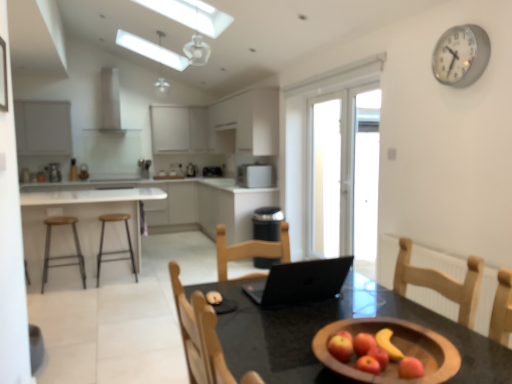
In order to face metallic brown stool at left, the 2th stool viewed from the right, should I rotate leftwards or rightwards?

To face it directly, rotate left by 24.686 degrees.

What is the approximate width of metallic brown stool at left, the 2th stool viewed from the right?

The width of metallic brown stool at left, the 2th stool viewed from the right, is 16.04 inches.

The image size is (512, 384). Describe the element at coordinates (184, 202) in the screenshot. I see `white matte cabinetry at left, which is the 4th cabinetry from right to left` at that location.

What do you see at coordinates (326, 177) in the screenshot? I see `transparent glass door at center` at bounding box center [326, 177].

What is the approximate width of white matte cabinet at center, arranged as the 1th cabinetry when viewed from the right?

white matte cabinet at center, arranged as the 1th cabinetry when viewed from the right, is 24.96 inches in width.

This screenshot has height=384, width=512. What are the coordinates of `matte white cabinet at left, the first cabinetry viewed from the left` in the screenshot? It's located at (42, 128).

At what (x,y) coordinates should I click in order to perform the action: click on satin silver toaster at center, which appears as the second appliance when viewed from the right. Please return your answer as a coordinate pair (x, y). The width and height of the screenshot is (512, 384). Looking at the image, I should click on (191, 170).

Could red matte apple at lower center be considered to be inside white metallic clock at upper right?

No, white metallic clock at upper right does not contain red matte apple at lower center.

From a real-world perspective, is white metallic clock at upper right positioned above or below red matte apple at lower center?

white metallic clock at upper right is situated higher than red matte apple at lower center in the real world.

Does white metallic clock at upper right turn towards red matte apple at lower center?

No, white metallic clock at upper right is not oriented towards red matte apple at lower center.

Consider the image. Considering the relative positions of white metallic clock at upper right and red matte apple at lower center in the image provided, is white metallic clock at upper right to the left of red matte apple at lower center from the viewer's perspective?

No, white metallic clock at upper right is not to the left of red matte apple at lower center.

Is wooden table at left located outside white matte cabinet at upper center, the 4th cabinetry in the left-to-right sequence?

Yes, wooden table at left is outside of white matte cabinet at upper center, the 4th cabinetry in the left-to-right sequence.

How distant is wooden table at left from white matte cabinet at upper center, the 2th cabinetry from the right?

wooden table at left is 3.41 meters from white matte cabinet at upper center, the 2th cabinetry from the right.

From the image's perspective, which is below, wooden table at left or white matte cabinet at upper center, the 2th cabinetry from the right?

wooden table at left is shown below in the image.

Is wooden table at left positioned behind white matte cabinet at upper center, the 4th cabinetry in the left-to-right sequence?

No, wooden table at left is closer to the camera.

Which of these two, black matte laptop at center or white matte cabinet at upper center, the 3th cabinetry viewed from the right, is thinner?

white matte cabinet at upper center, the 3th cabinetry viewed from the right.

From the black matte laptop at center, count 5th cabinetrys backward and point to it. Please provide its 2D coordinates.

[(184, 130)]

Would you say black matte laptop at center is inside or outside white matte cabinet at upper center, which appears as the third cabinetry when viewed from the left?

black matte laptop at center is spatially situated outside white matte cabinet at upper center, which appears as the third cabinetry when viewed from the left.

Is black matte laptop at center facing towards white matte cabinet at upper center, the 3th cabinetry viewed from the right?

Yes, black matte laptop at center is aimed at white matte cabinet at upper center, the 3th cabinetry viewed from the right.

Is point (54, 175) less distant than point (77, 239)?

No, it is behind (77, 239).

From a real-world perspective, is brushed metal kettle at left, marked as the third appliance in a back-to-front arrangement, physically located above or below metallic brown stool at left, the 2th stool viewed from the right?

brushed metal kettle at left, marked as the third appliance in a back-to-front arrangement, is situated higher than metallic brown stool at left, the 2th stool viewed from the right, in the real world.

Considering the sizes of brushed metal kettle at left, positioned as the first appliance in left-to-right order, and metallic brown stool at left, the 2th stool viewed from the right, in the image, is brushed metal kettle at left, positioned as the first appliance in left-to-right order, wider or thinner than metallic brown stool at left, the 2th stool viewed from the right,?

brushed metal kettle at left, positioned as the first appliance in left-to-right order, is thinner than metallic brown stool at left, the 2th stool viewed from the right.

From the brushed metal kettle at left, marked as the third appliance in a back-to-front arrangement, count 2nd stools forward and point to it. Please provide its 2D coordinates.

[(62, 255)]

You are a GUI agent. You are given a task and a screenshot of the screen. Output one action in this format:
    pyautogui.click(x=<x>, y=<y>)
    Task: Click on the 2nd cabinetry positioned above the transparent glass door at center (from the image's perspective)
    
    Given the screenshot: What is the action you would take?
    pyautogui.click(x=42, y=128)

How different are the orientations of transparent glass door at center and matte white cabinet at left, the first cabinetry viewed from the left, in degrees?

transparent glass door at center and matte white cabinet at left, the first cabinetry viewed from the left, are facing 89.7 degrees away from each other.

Is point (320, 242) positioned before point (52, 140)?

Yes, it is in front of point (52, 140).

Considering the relative sizes of transparent glass door at center and matte white cabinet at left, the first cabinetry viewed from the left, in the image provided, is transparent glass door at center shorter than matte white cabinet at left, the first cabinetry viewed from the left,?

In fact, transparent glass door at center may be taller than matte white cabinet at left, the first cabinetry viewed from the left.

Does satin white microwave at center have a lesser width compared to white metallic clock at upper right?

No.

Where is `kitchen appliance that is behind the white metallic clock at upper right`? This screenshot has width=512, height=384. kitchen appliance that is behind the white metallic clock at upper right is located at coordinates (255, 176).

Considering the sizes of satin white microwave at center and white metallic clock at upper right in the image, is satin white microwave at center taller or shorter than white metallic clock at upper right?

In the image, satin white microwave at center appears to be shorter than white metallic clock at upper right.

From a real-world perspective, is satin white microwave at center positioned over white metallic clock at upper right based on gravity?

Incorrect, from a real-world perspective, satin white microwave at center is lower than white metallic clock at upper right.

Relative to white matte cabinet at center, arranged as the 1th cabinetry when viewed from the right, is wooden table at left in front or behind?

Clearly, wooden table at left is in front of white matte cabinet at center, arranged as the 1th cabinetry when viewed from the right.

Between wooden table at left and white matte cabinet at center, the fifth cabinetry from the left, which one appears on the left side from the viewer's perspective?

From the viewer's perspective, wooden table at left appears more on the left side.

Is wooden table at left far from white matte cabinet at center, arranged as the 1th cabinetry when viewed from the right?

Yes, wooden table at left is far from white matte cabinet at center, arranged as the 1th cabinetry when viewed from the right.

Is wooden table at left facing towards white matte cabinet at center, the fifth cabinetry from the left?

Yes, wooden table at left is facing white matte cabinet at center, the fifth cabinetry from the left.

Find the location of a particular element. Image resolution: width=512 pixels, height=384 pixels. clock above the red matte apple at lower center (from a real-world perspective) is located at coordinates (461, 55).

I want to click on table in front of the white matte cabinet at upper center, the 4th cabinetry in the left-to-right sequence, so click(x=81, y=220).

From the image, which object appears to be farther from wooden/metallic stool at left, the 1th stool from the right, satin silver toaster at center, placed as the 3th appliance when sorted from front to back, or satin silver toaster at center, which is the second appliance from back to front?

The object further to wooden/metallic stool at left, the 1th stool from the right, is satin silver toaster at center, placed as the 3th appliance when sorted from front to back.

When comparing their distances from transparent glass door at center, does white matte cabinet at center, arranged as the 1th cabinetry when viewed from the right, or brushed metal kettle at left, positioned as the first appliance in left-to-right order, seem further?

The object further to transparent glass door at center is brushed metal kettle at left, positioned as the first appliance in left-to-right order.

Considering their positions, is white metallic clock at upper right positioned further to satin white microwave at center than black matte laptop at center?

Based on the image, black matte laptop at center appears to be further to satin white microwave at center.

From the image, which object appears to be nearer to matte white cabinet at left, the first cabinetry viewed from the left, wooden table at left or satin white microwave at center?

wooden table at left lies closer to matte white cabinet at left, the first cabinetry viewed from the left, than the other object.

Estimate the real-world distances between objects in this image. Which object is further from matte white cabinet at left, which appears as the 5th cabinetry when viewed from the right, satin white microwave at center or transparent glass door at center?

transparent glass door at center lies further to matte white cabinet at left, which appears as the 5th cabinetry when viewed from the right, than the other object.

Looking at this image, from the image, which object appears to be farther from transparent glass door at center, wooden table at left or matte white cabinet at left, which appears as the 5th cabinetry when viewed from the right?

matte white cabinet at left, which appears as the 5th cabinetry when viewed from the right, is further to transparent glass door at center.

Which object lies nearer to the anchor point white matte cabinet at upper center, the 3th cabinetry viewed from the right, wooden table at left or satin silver toaster at center, which is counted as the 1th appliance, starting from the back?

The object closer to white matte cabinet at upper center, the 3th cabinetry viewed from the right, is satin silver toaster at center, which is counted as the 1th appliance, starting from the back.

Looking at this image, when comparing their distances from black matte laptop at center, does white metallic clock at upper right or satin white microwave at center seem further?

The object further to black matte laptop at center is satin white microwave at center.

The height and width of the screenshot is (384, 512). Identify the location of exhaust hood between wooden table at left and satin silver toaster at center, marked as the 1th appliance in a right-to-left arrangement, along the z-axis. click(110, 101).

At what (x,y) coordinates should I click in order to perform the action: click on stool between metallic brown stool at left, acting as the 1th stool starting from the left, and matte white cabinet at left, which appears as the 5th cabinetry when viewed from the right, from front to back. Please return your answer as a coordinate pair (x, y). This screenshot has height=384, width=512. Looking at the image, I should click on (117, 250).

You are a GUI agent. You are given a task and a screenshot of the screen. Output one action in this format:
    pyautogui.click(x=<x>, y=<y>)
    Task: Click on the table between red matte apple at lower center and brushed metal kettle at left, marked as the 1th appliance in a front-to-back arrangement, in the front-back direction
    
    Given the screenshot: What is the action you would take?
    pyautogui.click(x=81, y=220)

You are a GUI agent. You are given a task and a screenshot of the screen. Output one action in this format:
    pyautogui.click(x=<x>, y=<y>)
    Task: Click on the clock between black matte laptop at center and transparent glass door at center along the z-axis
    The height and width of the screenshot is (384, 512).
    Given the screenshot: What is the action you would take?
    pyautogui.click(x=461, y=55)